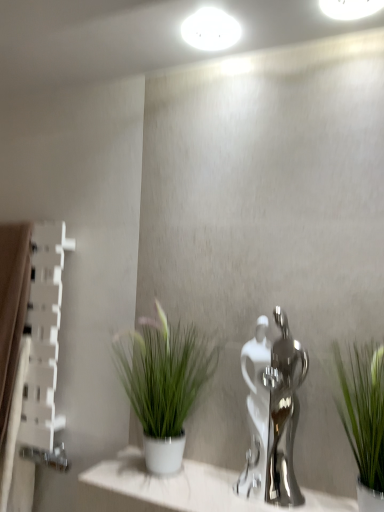
Question: Is polished chrome faucet at center positioned beyond the bounds of white glossy light fixture at upper center, which is the 2th lighting from left to right?

Choices:
 (A) no
 (B) yes

Answer: (B)

Question: Considering the relative positions of polished chrome faucet at center and white glossy light fixture at upper center, which is the 2th lighting from left to right, in the image provided, is polished chrome faucet at center to the right of white glossy light fixture at upper center, which is the 2th lighting from left to right, from the viewer's perspective?

Choices:
 (A) yes
 (B) no

Answer: (B)

Question: From the image's perspective, is polished chrome faucet at center under white glossy light fixture at upper center, which is the 2th lighting from left to right?

Choices:
 (A) no
 (B) yes

Answer: (B)

Question: Does polished chrome faucet at center turn towards white glossy light fixture at upper center, acting as the first lighting starting from the front?

Choices:
 (A) no
 (B) yes

Answer: (A)

Question: Does polished chrome faucet at center have a larger size compared to white glossy light fixture at upper center, which is the 2th lighting from left to right?

Choices:
 (A) yes
 (B) no

Answer: (A)

Question: Is polished chrome faucet at center turned away from white glossy light fixture at upper center, acting as the first lighting starting from the right?

Choices:
 (A) yes
 (B) no

Answer: (B)

Question: From a real-world perspective, is green leafy plant at right, acting as the second houseplant starting from the back, positioned over white glossy ledge at center based on gravity?

Choices:
 (A) yes
 (B) no

Answer: (A)

Question: Considering the relative sizes of green leafy plant at right, acting as the second houseplant starting from the back, and white glossy ledge at center in the image provided, is green leafy plant at right, acting as the second houseplant starting from the back, thinner than white glossy ledge at center?

Choices:
 (A) no
 (B) yes

Answer: (B)

Question: Considering the relative sizes of green leafy plant at right, the first houseplant positioned from the front, and white glossy ledge at center in the image provided, is green leafy plant at right, the first houseplant positioned from the front, wider than white glossy ledge at center?

Choices:
 (A) no
 (B) yes

Answer: (A)

Question: Is there a large distance between green leafy plant at right, acting as the second houseplant starting from the back, and white glossy ledge at center?

Choices:
 (A) yes
 (B) no

Answer: (B)

Question: Is white glossy ledge at center at the back of green leafy plant at right, the first houseplant positioned from the front?

Choices:
 (A) yes
 (B) no

Answer: (B)

Question: Does green leafy plant at right, acting as the second houseplant starting from the back, have a smaller size compared to white glossy ledge at center?

Choices:
 (A) yes
 (B) no

Answer: (B)

Question: Is green leafy plant at right, acting as the second houseplant starting from the back, taller than polished chrome faucet at center?

Choices:
 (A) no
 (B) yes

Answer: (A)